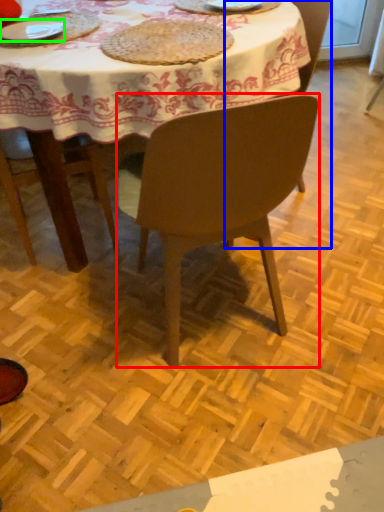
Question: Considering the real-world distances, which object is closest to chair (highlighted by a red box)? chair (highlighted by a blue box) or plate (highlighted by a green box).

Choices:
 (A) chair
 (B) plate

Answer: (A)